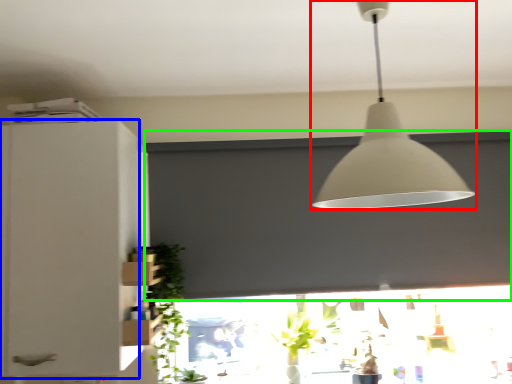
Question: Based on their relative distances, which object is farther from lamp (highlighted by a red box)? Choose from cabinetry (highlighted by a blue box) and window screen (highlighted by a green box).

Choices:
 (A) cabinetry
 (B) window screen

Answer: (A)